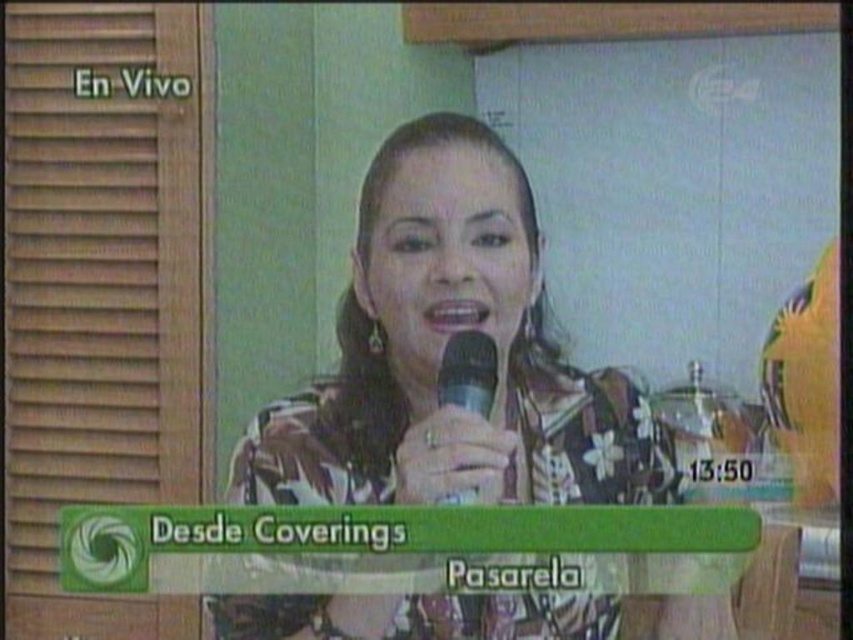
You are a camera operator adjusting the focus for a live broadcast. There are two points marked in the scene, one at position point (427, 416) and another at point (461, 332). Which point should you focus on first if you need to prioritize the one closer to the camera?

Point (461, 332) should be focused on first because it is closer to the camera than point (427, 416), which is further away.